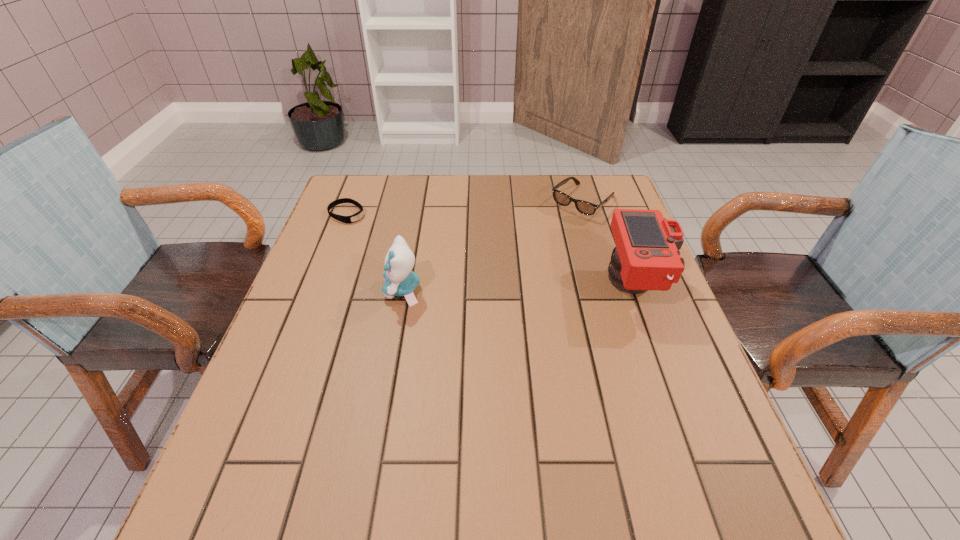
Where is `kitten`? The height and width of the screenshot is (540, 960). kitten is located at coordinates (400, 280).

You are a GUI agent. You are given a task and a screenshot of the screen. Output one action in this format:
    pyautogui.click(x=<x>, y=<y>)
    Task: Click on the camera
    
    Given the screenshot: What is the action you would take?
    pyautogui.click(x=646, y=257)

I want to click on spectacles, so click(584, 207).

I want to click on wristband, so click(x=357, y=216).

Locate an element on the screen. Image resolution: width=960 pixels, height=540 pixels. the shortest object is located at coordinates (357, 216).

I want to click on blank space located on the face of the kitten, so click(x=329, y=291).

What are the coordinates of `vacant space situated on the face of the kitten` in the screenshot? It's located at (358, 291).

This screenshot has height=540, width=960. What are the coordinates of `vacant region located on the face of the kitten` in the screenshot? It's located at (296, 291).

Locate an element on the screen. This screenshot has height=540, width=960. vacant space situated 0.130m on the back of the camera is located at coordinates (614, 226).

The height and width of the screenshot is (540, 960). I want to click on vacant area situated 0.340m on the lenses of the spectacles, so point(498,281).